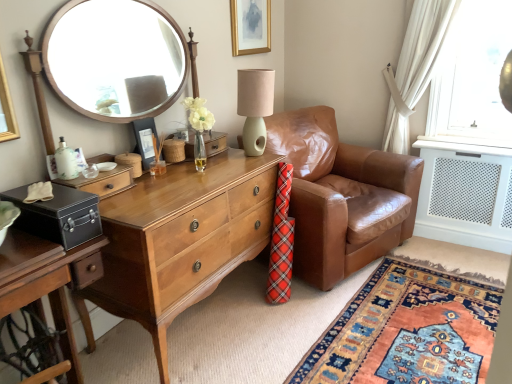
In order to click on free space to the left of mint green ceramic table lamp at center in this screenshot , I will do `click(222, 157)`.